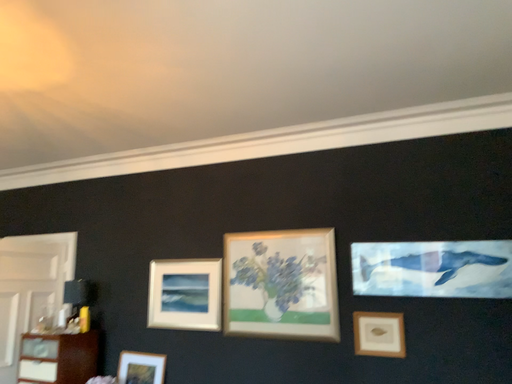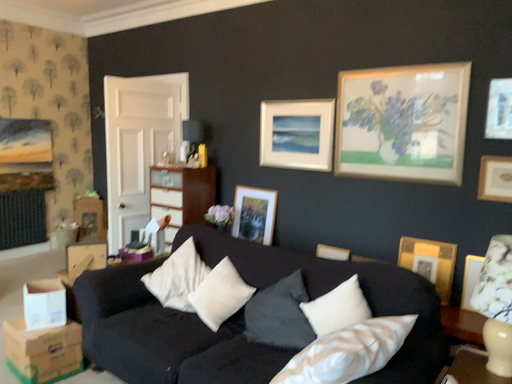
Question: Which way did the camera rotate in the video?

Choices:
 (A) rotated upward
 (B) rotated downward

Answer: (B)